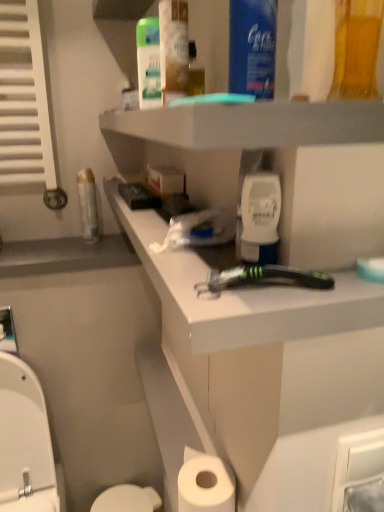
This screenshot has width=384, height=512. Identify the location of free region on the left part of white matte mouthwash at center, which is the third mouthwash in back-to-front order. (187, 268).